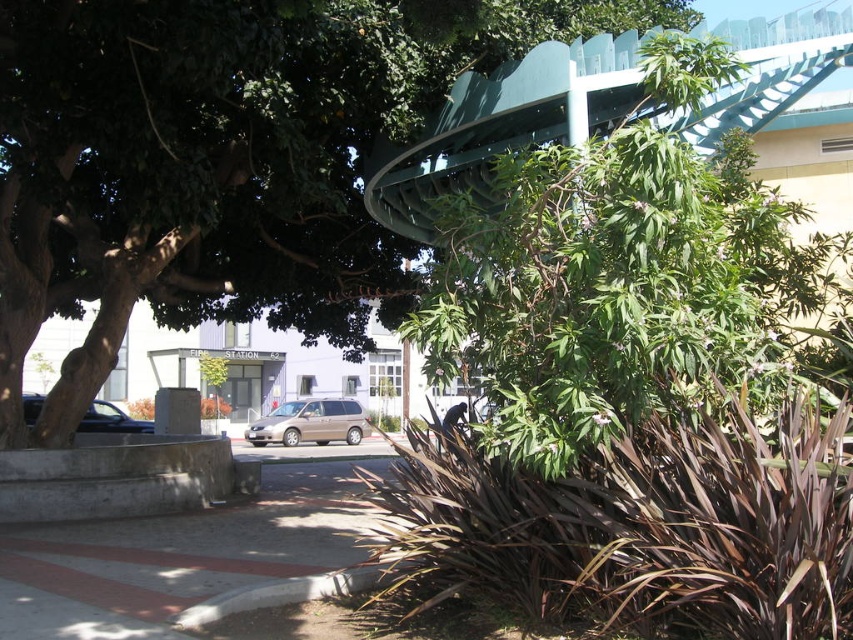
Question: Which point is closer to the camera?

Choices:
 (A) (183, 540)
 (B) (787, 84)

Answer: (A)

Question: Which of these objects is positioned closest to the concrete at lower left?

Choices:
 (A) shiny black sedan at left
 (B) gray concrete curb at lower center
 (C) green matte overpass at upper center
 (D) gold metallic minivan at center

Answer: (B)

Question: Is the position of green leafy tree at upper center more distant than that of green matte overpass at upper center?

Choices:
 (A) yes
 (B) no

Answer: (A)

Question: Is concrete at lower left to the right of gold metallic minivan at center from the viewer's perspective?

Choices:
 (A) yes
 (B) no

Answer: (A)

Question: Is green matte overpass at upper center positioned in front of gold metallic minivan at center?

Choices:
 (A) yes
 (B) no

Answer: (A)

Question: Among these objects, which one is farthest from the camera?

Choices:
 (A) concrete at lower left
 (B) gold metallic minivan at center
 (C) shiny black sedan at left

Answer: (B)